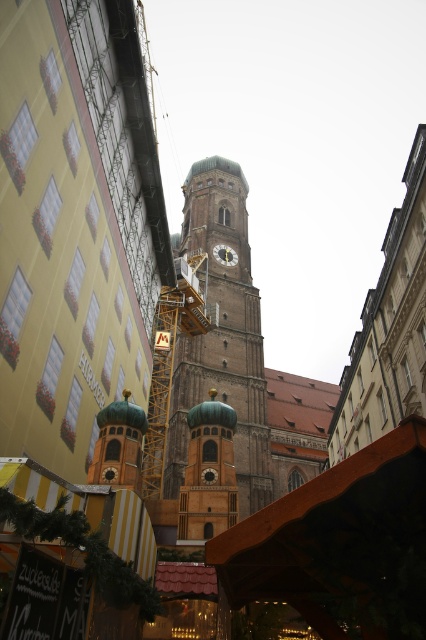
Question: Among these points, which one is nearest to the camera?

Choices:
 (A) (261, 493)
 (B) (201, 445)
 (C) (224, 262)

Answer: (B)

Question: Is brown stone tower at center smaller than gold metallic clock at center?

Choices:
 (A) no
 (B) yes

Answer: (A)

Question: Which point is closer to the camera taking this photo?

Choices:
 (A) (250, 451)
 (B) (226, 248)
 (C) (215, 509)

Answer: (C)

Question: Does brown stone tower at center come behind gold domed bell tower at center?

Choices:
 (A) yes
 (B) no

Answer: (A)

Question: Where is brown stone tower at center located in relation to gold metallic clock at center in the image?

Choices:
 (A) right
 (B) left

Answer: (B)

Question: Which point is closer to the camera?

Choices:
 (A) (198, 477)
 (B) (233, 220)

Answer: (A)